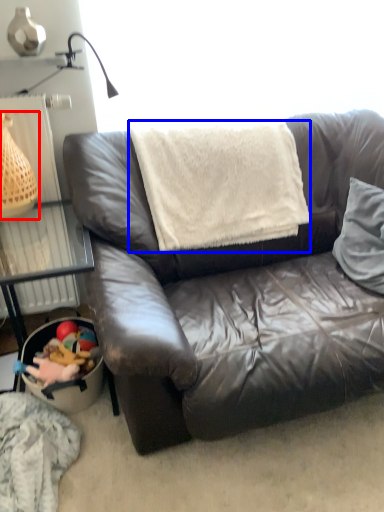
Question: Which object is further to the camera taking this photo, basket (highlighted by a red box) or blanket (highlighted by a blue box)?

Choices:
 (A) basket
 (B) blanket

Answer: (B)